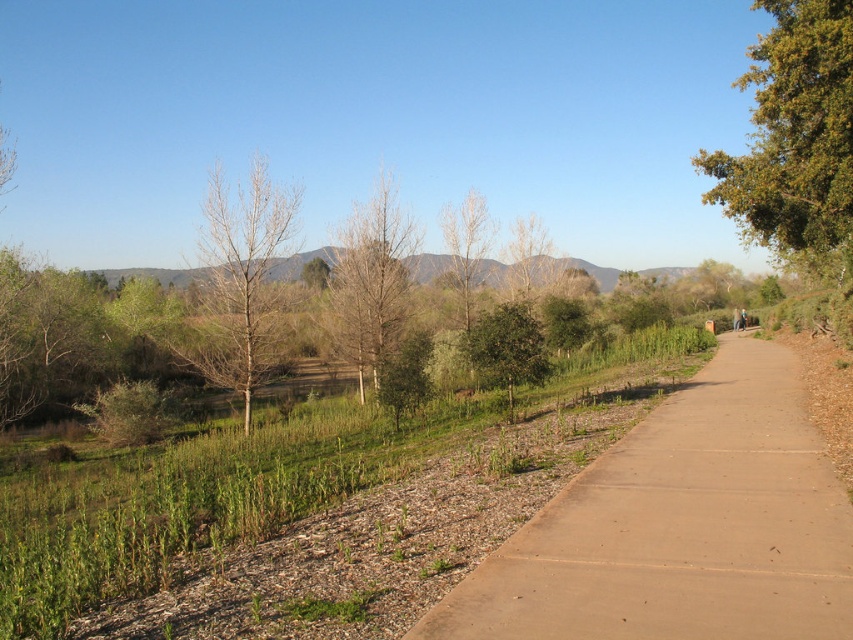
Question: Can you confirm if green leafy tree at upper right is positioned to the right of green leafy tree at center?

Choices:
 (A) no
 (B) yes

Answer: (B)

Question: Can you confirm if green leafy tree at upper right is positioned to the right of green leafy tree at center?

Choices:
 (A) yes
 (B) no

Answer: (A)

Question: Which point is farther to the camera?

Choices:
 (A) (355, 314)
 (B) (833, 52)
 (C) (706, 372)
 (D) (209, 308)

Answer: (A)

Question: Does green leafy tree at upper right appear under bare wood tree at center?

Choices:
 (A) yes
 (B) no

Answer: (B)

Question: Which object appears farthest from the camera in this image?

Choices:
 (A) green leafy tree at upper right
 (B) brown concrete path at center
 (C) bare wood tree at center
 (D) green leafy tree at center

Answer: (C)

Question: Which of the following is the closest to the observer?

Choices:
 (A) brown matte tree at center
 (B) brown concrete path at center

Answer: (B)